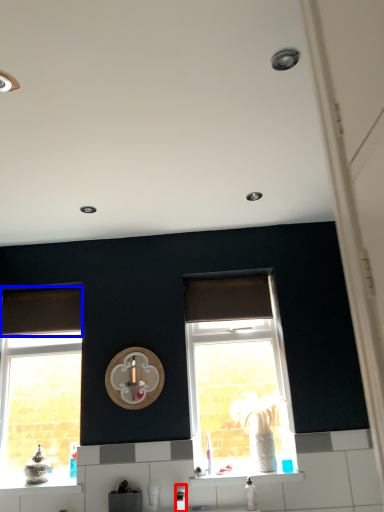
Question: Which object is further to the camera taking this photo, appliance (highlighted by a red box) or curtain (highlighted by a blue box)?

Choices:
 (A) appliance
 (B) curtain

Answer: (B)